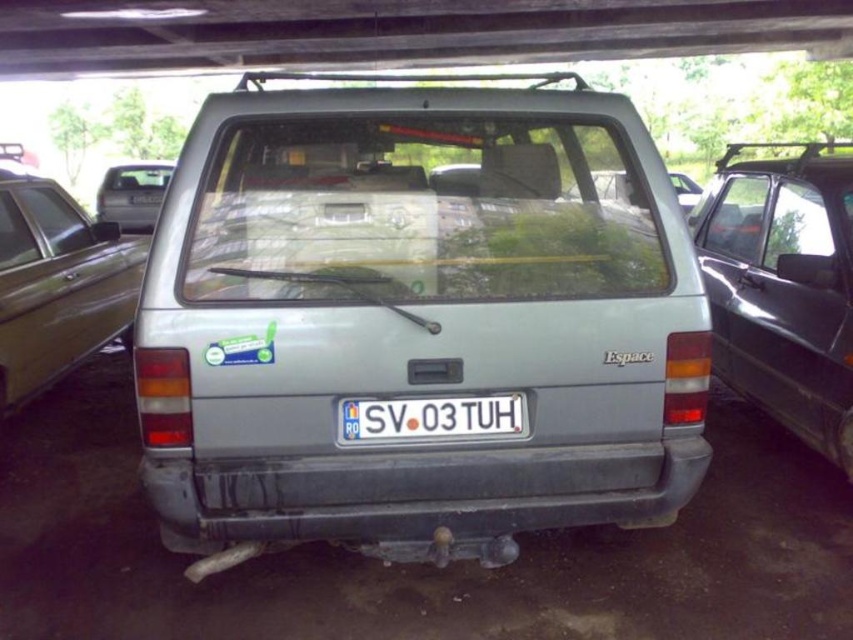
You are driving a car and need to exit the garage. You see a metallic gray minivan at right and a matte gray van at left. Which vehicle is blocking your path?

The matte gray van at left is behind the metallic gray minivan at right, so the metallic gray minivan at right is blocking your path.

You are a delivery person who needs to place a package on the gray matte bumper at center of a Renault Espace. The package is 8 feet long. Will the package fit on the bumper?

The package is 8 feet long, and the distance between the gray matte bumper at center and the camera is 8.16 feet. Since the package is slightly shorter than the available space, it will fit on the bumper.

You are a car designer evaluating the rear design of a Renault Espace. You need to compare the width of the gray matte bumper at center and the white plastic license plate at center. Which one is wider?

The gray matte bumper at center is wider than the white plastic license plate at center according to the description.